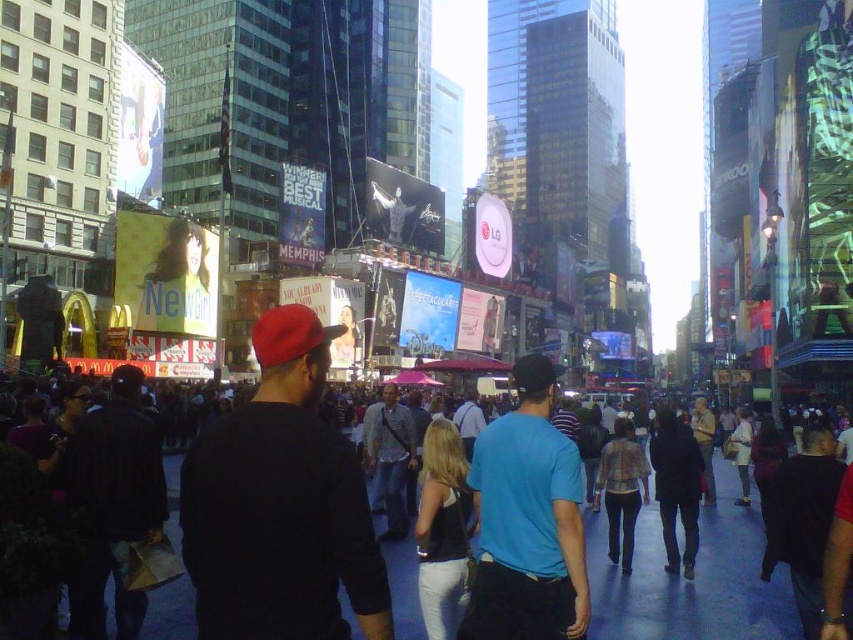
Question: Does black cotton crowd at center appear on the right side of metallic statue at center?

Choices:
 (A) no
 (B) yes

Answer: (B)

Question: Among these objects, which one is nearest to the camera?

Choices:
 (A) matte black shirt at center
 (B) metallic statue at center
 (C) plaid shirt at center

Answer: (A)

Question: Which of the following is the farthest from the observer?

Choices:
 (A) black cotton crowd at center
 (B) smooth skin portrait at center
 (C) blue cotton shirt at center
 (D) plaid shirt at center

Answer: (B)

Question: Does smooth skin portrait at center have a larger size compared to plaid shirt at center?

Choices:
 (A) yes
 (B) no

Answer: (B)

Question: Is plaid shirt at center bigger than metallic statue at center?

Choices:
 (A) no
 (B) yes

Answer: (B)

Question: Which object is closer to the camera taking this photo?

Choices:
 (A) black cotton crowd at center
 (B) matte black shirt at center

Answer: (B)